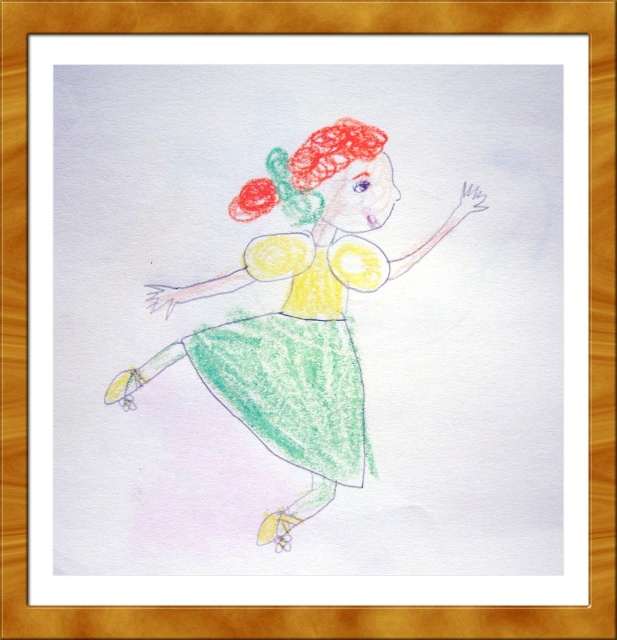
Does pastel green dress at center appear on the right side of pastel green crayon dress at center?

No, pastel green dress at center is not to the right of pastel green crayon dress at center.

You are a GUI agent. You are given a task and a screenshot of the screen. Output one action in this format:
    pyautogui.click(x=<x>, y=<y>)
    Task: Click on the pastel green dress at center
    
    Given the screenshot: What is the action you would take?
    pyautogui.click(x=300, y=312)

Does point (344, 230) come farther from viewer compared to point (241, 324)?

Yes, point (344, 230) is farther from viewer.

The width and height of the screenshot is (617, 640). I want to click on pastel green dress at center, so click(300, 312).